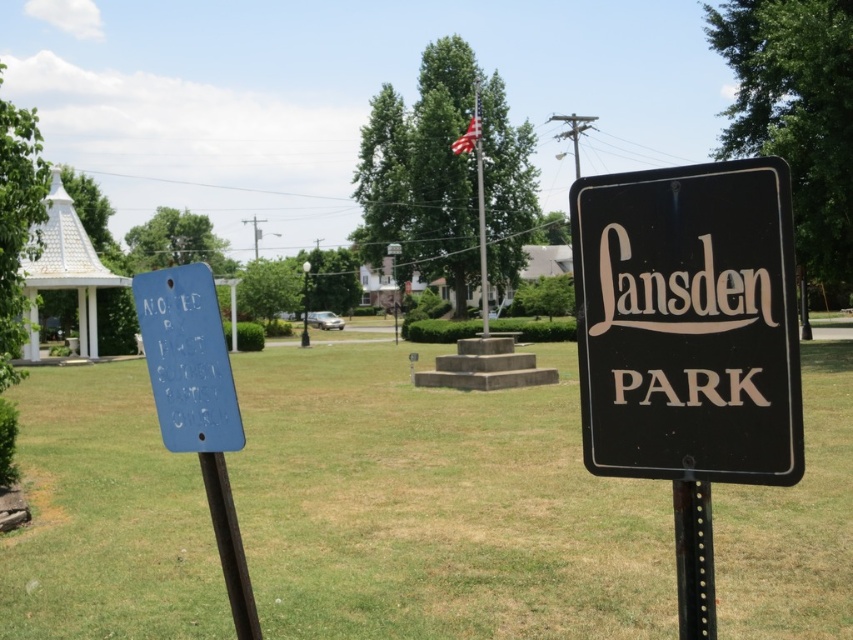
You are standing at the entrance of Lansden Park and want to walk towards the green grass at center. Which direction should you move relative to the metallic flagpole at center?

Since the green grass at center is closer to the viewer than the metallic flagpole at center, you should move towards the green grass at center which is in front of the metallic flagpole at center.

You are planning to hang a new rectangular notice board that is 15 cm wide between the black matte sign at right and the blue painted metal sign at left. Based on their current widths, will the notice board fit between them without overlapping?

The black matte sign at right is thinner than the blue painted metal sign at left. Since the notice board is 15 cm wide, it can fit between them as long as the space between the two signs is at least 15 cm. However, the exact distance isn